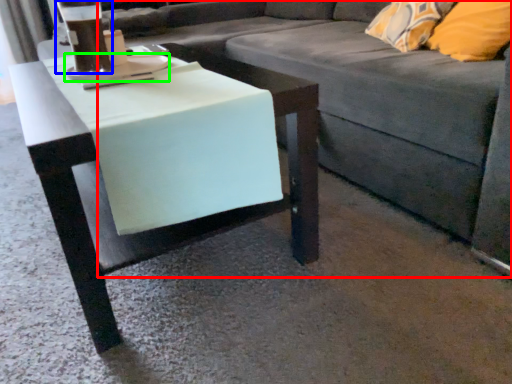
Question: Considering the real-world distances, which object is farthest from studio couch (highlighted by a red box)? beverage (highlighted by a blue box) or saucer (highlighted by a green box)?

Choices:
 (A) beverage
 (B) saucer

Answer: (A)